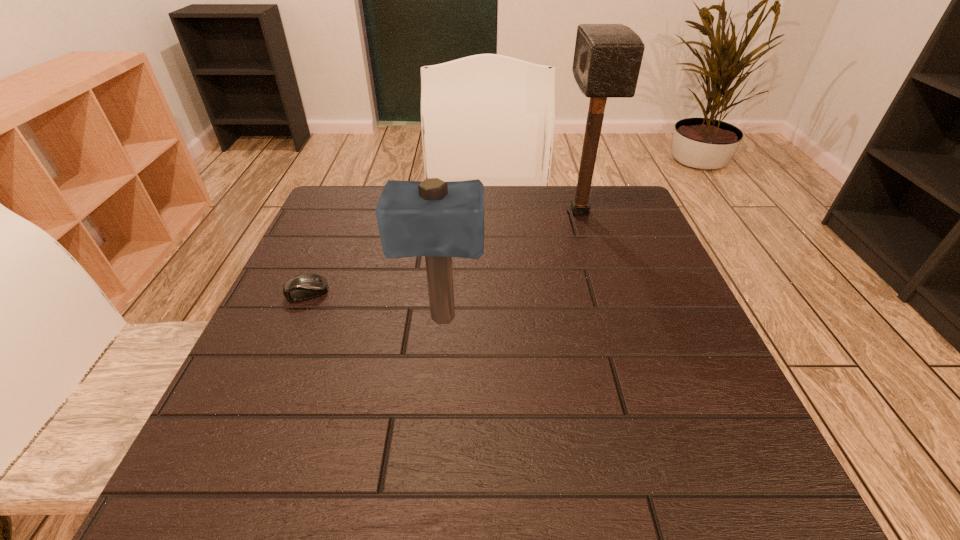
Where is `empty space between the shorter mallet and the leftmost object`? empty space between the shorter mallet and the leftmost object is located at coordinates (374, 306).

I want to click on vacant space in between the second tallest object and the mouse, so click(x=374, y=306).

This screenshot has height=540, width=960. Identify the location of free point between the second tallest object and the leftmost object. (374, 306).

This screenshot has width=960, height=540. In order to click on free point between the second object from right to left and the taller mallet in this screenshot , I will do `click(511, 266)`.

At what (x,y) coordinates should I click in order to perform the action: click on empty space that is in between the second object from right to left and the leftmost object. Please return your answer as a coordinate pair (x, y). Image resolution: width=960 pixels, height=540 pixels. Looking at the image, I should click on (374, 306).

This screenshot has width=960, height=540. I want to click on free space between the second tallest object and the taller mallet, so click(511, 266).

This screenshot has height=540, width=960. I want to click on empty location between the leftmost object and the nearer mallet, so click(x=374, y=306).

Identify the location of object that stands as the second closest to the shortest object. (607, 58).

Select which object is the closest to the left mallet. Please provide its 2D coordinates. Your answer should be formatted as a tuple, i.e. [(x, y)], where the tuple contains the x and y coordinates of a point satisfying the conditions above.

[(305, 286)]

At what (x,y) coordinates should I click in order to perform the action: click on blank area in the image that satisfies the following two spatial constraints: 1. on the back side of the leftmost object; 2. on the left side of the farthest object. Please return your answer as a coordinate pair (x, y). Looking at the image, I should click on (342, 212).